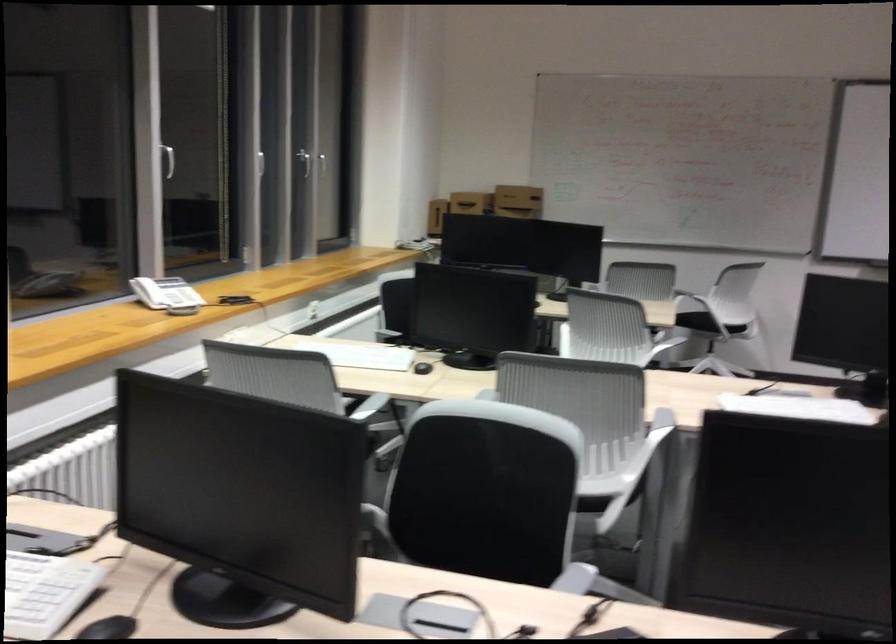
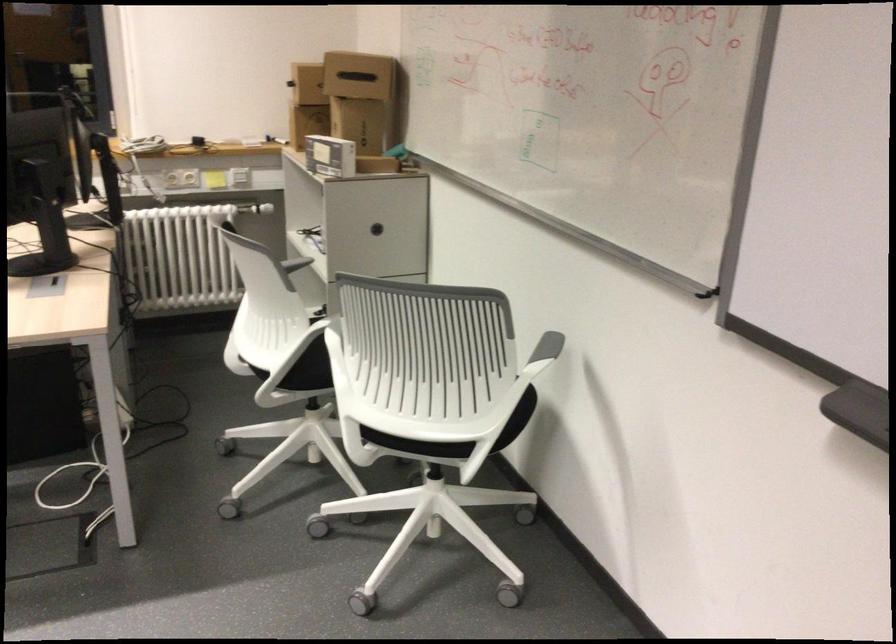
Locate, in the second image, the point that corresponds to point 538,192 in the first image.

(358, 75)